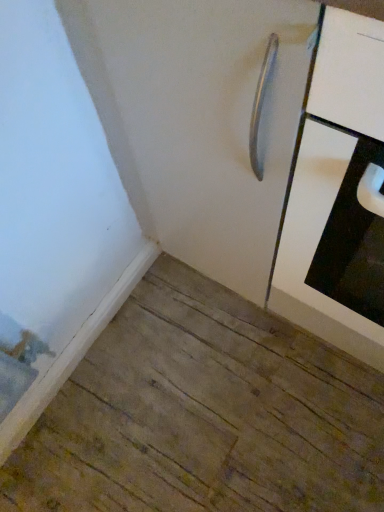
Question: Which is correct: white matte door at center is inside white glossy cabinet at upper right, or outside of it?

Choices:
 (A) inside
 (B) outside

Answer: (B)

Question: From a real-world perspective, is white matte door at center physically located above or below white glossy cabinet at upper right?

Choices:
 (A) below
 (B) above

Answer: (A)

Question: Is white matte door at center bigger or smaller than white glossy cabinet at upper right?

Choices:
 (A) small
 (B) big

Answer: (B)

Question: Is point (299, 292) positioned closer to the camera than point (168, 237)?

Choices:
 (A) farther
 (B) closer

Answer: (B)

Question: Looking at the image, does white glossy cabinet at upper right seem bigger or smaller compared to white matte door at center?

Choices:
 (A) small
 (B) big

Answer: (A)

Question: From the image's perspective, is white glossy cabinet at upper right located above or below white matte door at center?

Choices:
 (A) below
 (B) above

Answer: (A)

Question: From a real-world perspective, relative to white matte door at center, is white glossy cabinet at upper right vertically above or below?

Choices:
 (A) below
 (B) above

Answer: (B)